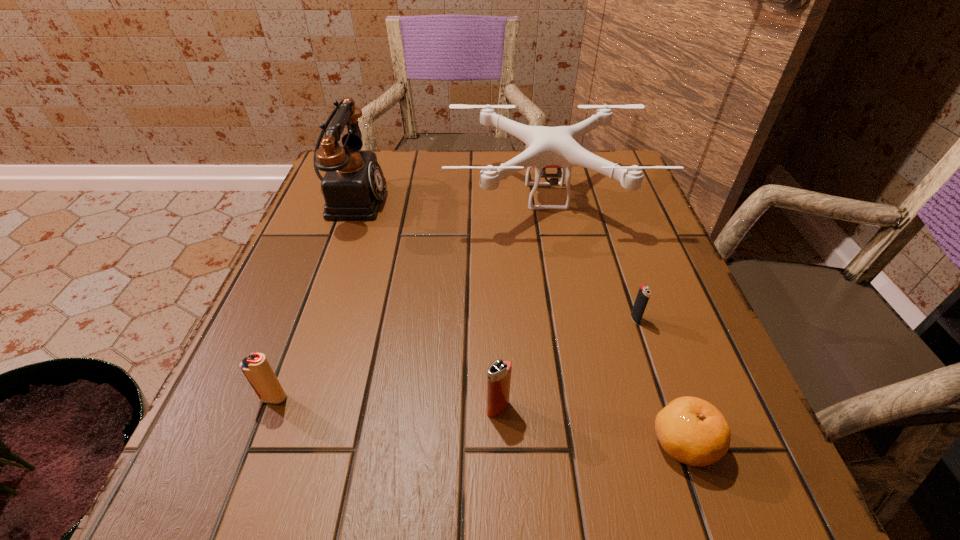
This screenshot has width=960, height=540. I want to click on clementine that is at the right edge, so click(x=691, y=430).

Where is `object situated at the far left corner`? object situated at the far left corner is located at coordinates (353, 186).

Identify the location of object that is at the far right corner. The height and width of the screenshot is (540, 960). (548, 147).

This screenshot has height=540, width=960. Find the location of `object located in the near right corner section of the desktop`. object located in the near right corner section of the desktop is located at coordinates (691, 430).

Where is `free region at the far edge of the desktop`? The height and width of the screenshot is (540, 960). free region at the far edge of the desktop is located at coordinates (497, 164).

Identify the location of vacant space at the near edge of the desktop. (545, 516).

In the image, there is a desktop. At what (x,y) coordinates should I click in order to perform the action: click on vacant space at the left edge. Please return your answer as a coordinate pair (x, y). The height and width of the screenshot is (540, 960). Looking at the image, I should click on (294, 339).

The width and height of the screenshot is (960, 540). In the image, there is a desktop. Identify the location of vacant space at the right edge. (588, 210).

In the image, there is a desktop. Identify the location of vacant space at the far right corner. (632, 193).

Identify the location of vacant area at the near right corner. (726, 462).